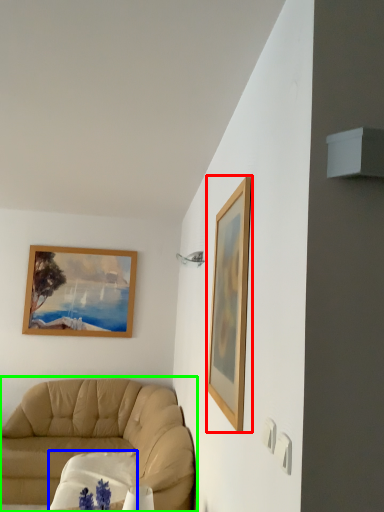
Question: Which is farther away from picture frame (highlighted by a red box)? round table (highlighted by a blue box) or studio couch (highlighted by a green box)?

Choices:
 (A) round table
 (B) studio couch

Answer: (B)